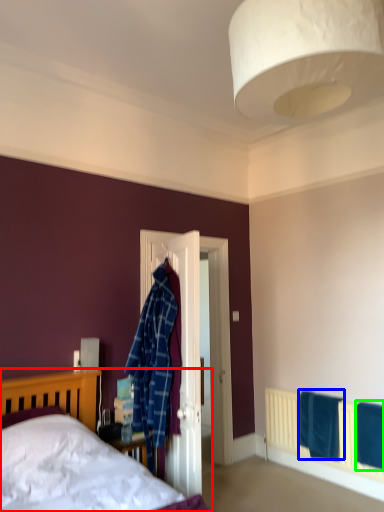
Question: Which object is positioned farthest from bed (highlighted by a red box)? Select from bath towel (highlighted by a blue box) and bath towel (highlighted by a green box).

Choices:
 (A) bath towel
 (B) bath towel

Answer: (B)